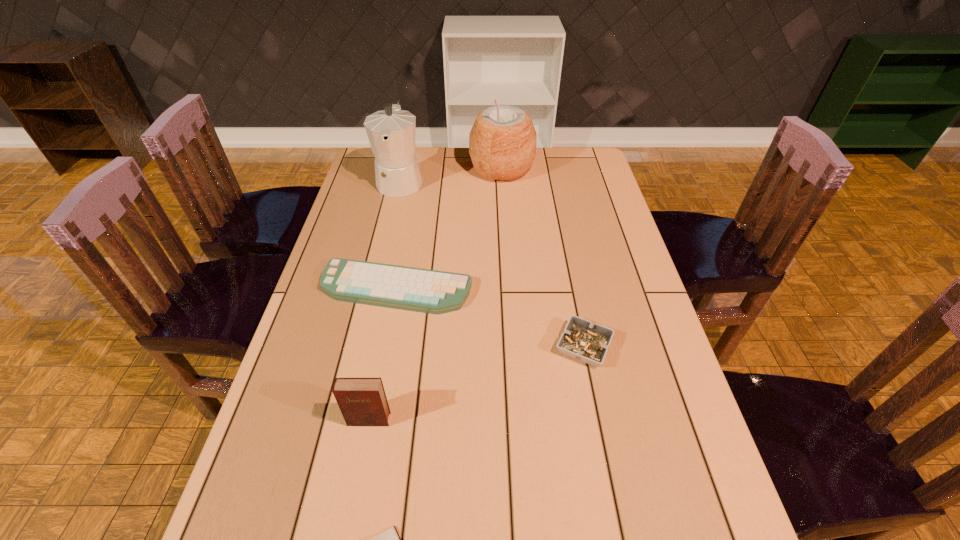
At what (x,y) coordinates should I click in order to perform the action: click on free space that satisfies the following two spatial constraints: 1. on the front side of the fourth nearest object; 2. on the right side of the third nearest object. Please return your answer as a coordinate pair (x, y). Looking at the image, I should click on (386, 347).

In order to click on free space that satisfies the following two spatial constraints: 1. at the spout of the ashtray; 2. on the left side of the coffeepot in this screenshot , I will do `click(362, 347)`.